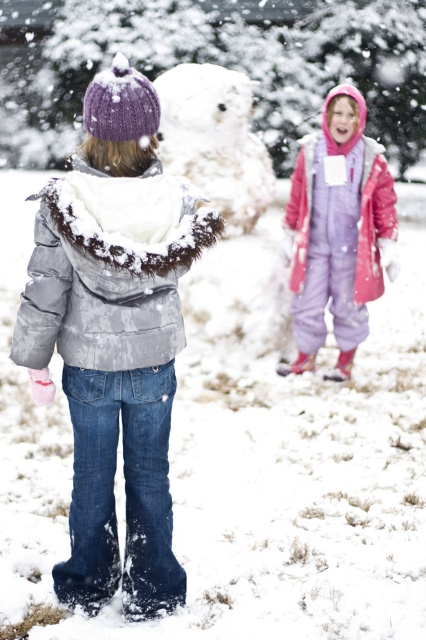
Question: Considering the relative positions of white fluffy snowman at center and purple fleece jacket at upper right in the image provided, where is white fluffy snowman at center located with respect to purple fleece jacket at upper right?

Choices:
 (A) left
 (B) right

Answer: (A)

Question: Can you confirm if fuzzy gray jacket at back is thinner than purple fleece jacket at upper right?

Choices:
 (A) no
 (B) yes

Answer: (A)

Question: Which is nearer to the purple fleece jacket at upper right?

Choices:
 (A) white fluffy snowman at center
 (B) fuzzy gray jacket at back

Answer: (A)

Question: Which object is positioned closest to the fuzzy gray jacket at back?

Choices:
 (A) white fluffy snowman at center
 (B) purple fleece jacket at upper right

Answer: (B)

Question: Does fuzzy gray jacket at back come in front of purple fleece jacket at upper right?

Choices:
 (A) yes
 (B) no

Answer: (A)

Question: Which object is closer to the camera taking this photo?

Choices:
 (A) purple fleece jacket at upper right
 (B) white fluffy snowman at center
 (C) fuzzy gray jacket at back

Answer: (C)